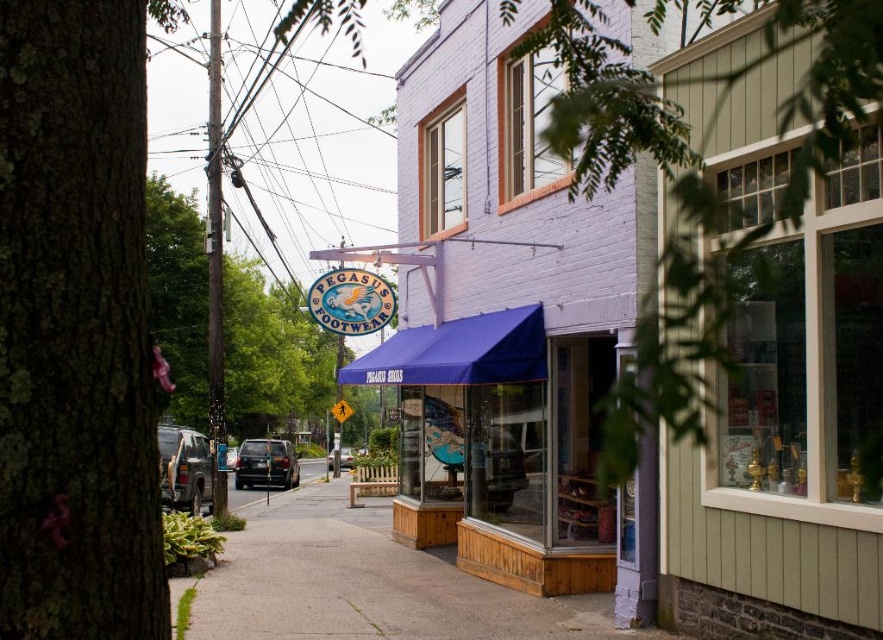
Is point (27, 483) more distant than point (206, 340)?

No.

The height and width of the screenshot is (640, 883). I want to click on green rough bark tree at left, so click(74, 326).

Does point (327, 381) lie behind point (351, 452)?

Yes, point (327, 381) is farther from viewer.

Is green leafy tree at center positioned before matte black suv at center?

Yes, green leafy tree at center is closer to the viewer.

What do you see at coordinates (270, 355) in the screenshot? The image size is (883, 640). I see `green leafy tree at center` at bounding box center [270, 355].

Where is `green leafy tree at center`? The width and height of the screenshot is (883, 640). green leafy tree at center is located at coordinates (270, 355).

Can you confirm if matte green window at center is positioned to the left of blue fabric awning at center?

In fact, matte green window at center is to the right of blue fabric awning at center.

Can you confirm if matte green window at center is thinner than blue fabric awning at center?

No.

Is point (829, 237) closer to camera compared to point (419, 513)?

Yes, point (829, 237) is in front of point (419, 513).

I want to click on matte green window at center, so click(789, 442).